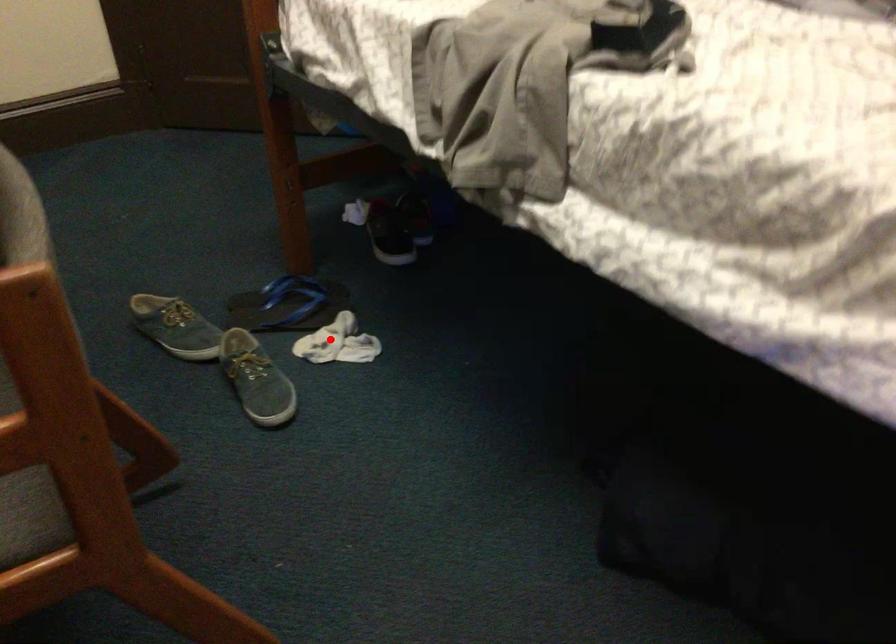
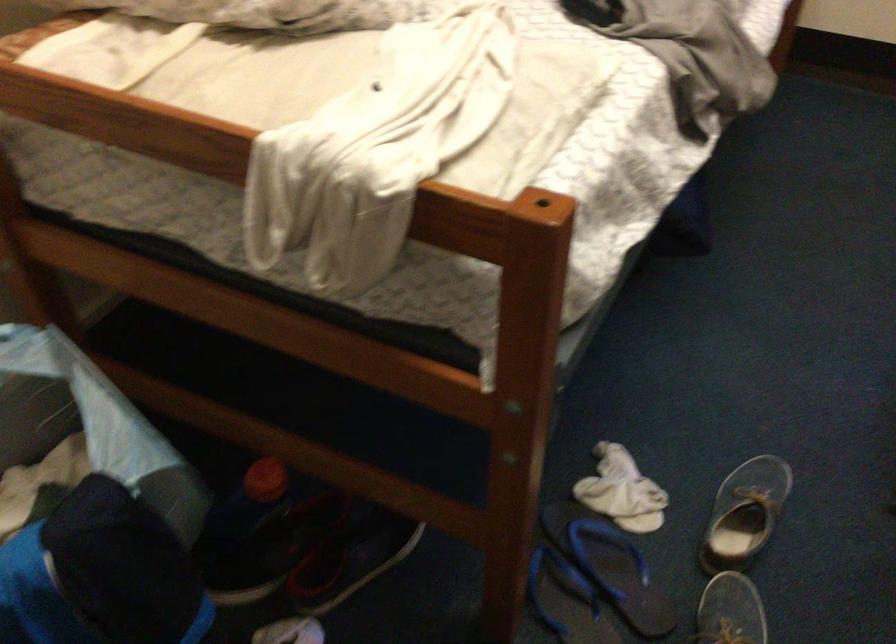
In the second image, find the point that corresponds to the highlighted location in the first image.

(622, 491)